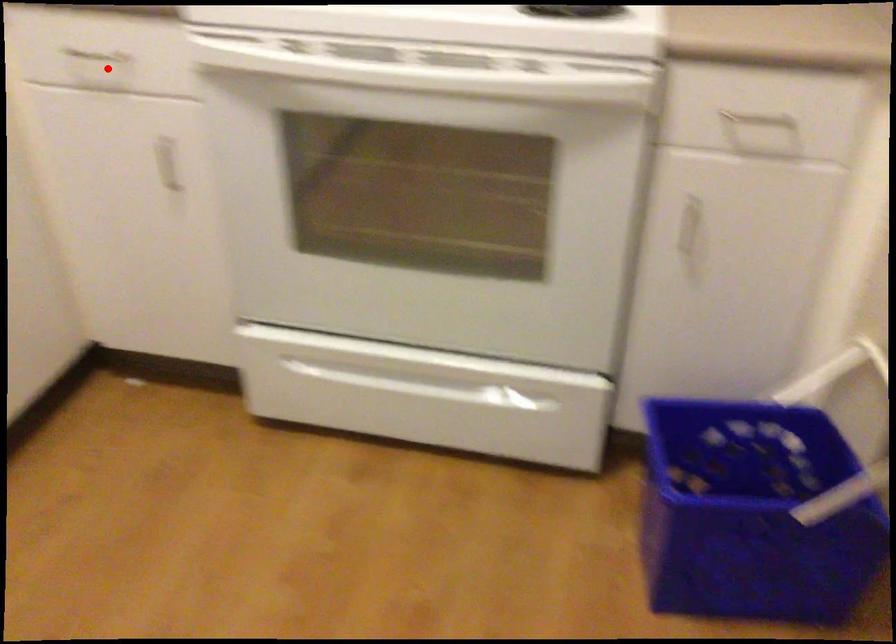
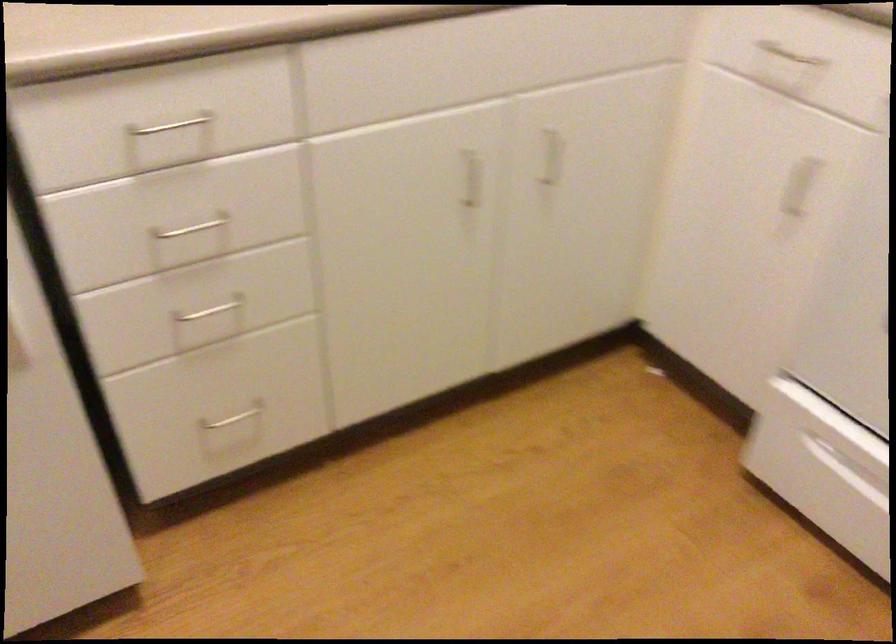
Question: I am providing you with two images of the same scene from different viewpoints. In image1, a red point is highlighted. Considering the same 3D point in image2, which of the following is correct?

Choices:
 (A) It is closer
 (B) It is farther

Answer: (A)